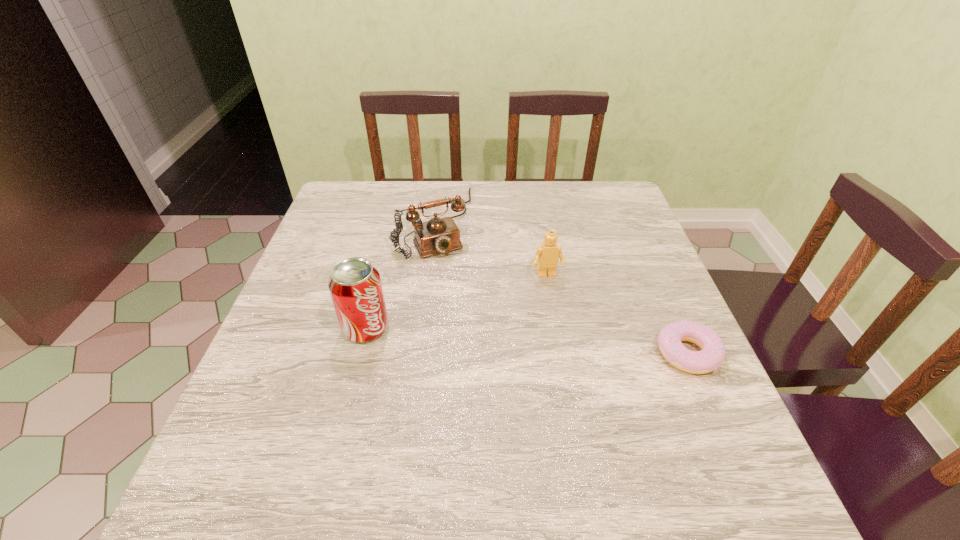
Where is `free point at the right edge`? The image size is (960, 540). free point at the right edge is located at coordinates point(615,321).

The width and height of the screenshot is (960, 540). In order to click on free space at the near left corner in this screenshot , I will do `click(294, 434)`.

This screenshot has height=540, width=960. In the image, there is a desktop. What are the coordinates of `vacant region at the far right corner` in the screenshot? It's located at (611, 222).

At what (x,y) coordinates should I click in order to perform the action: click on free space at the near right corner of the desktop. Please return your answer as a coordinate pair (x, y). Looking at the image, I should click on (653, 419).

Find the location of a particular element. free area in between the second farthest object and the soda can is located at coordinates (457, 302).

Find the location of `free point between the telephone and the soda can`. free point between the telephone and the soda can is located at coordinates (400, 275).

Where is `empty location between the soda can and the shortest object`? This screenshot has height=540, width=960. empty location between the soda can and the shortest object is located at coordinates (527, 341).

Find the location of a particular element. free area in between the third object from left to right and the soda can is located at coordinates (457, 302).

Find the location of a particular element. This screenshot has width=960, height=540. free area in between the shortest object and the second object from right to left is located at coordinates (617, 315).

I want to click on unoccupied area between the telephone and the soda can, so click(x=400, y=275).